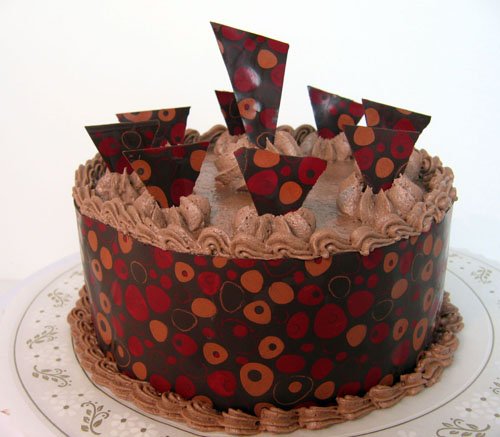
This screenshot has width=500, height=437. Find the location of `border design`. border design is located at coordinates click(x=477, y=375).